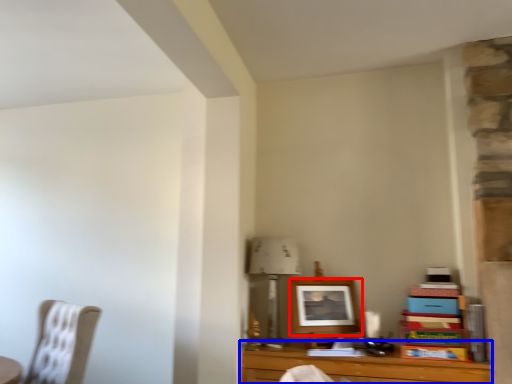
Question: Among these objects, which one is farthest to the camera, picture frame (highlighted by a red box) or table (highlighted by a blue box)?

Choices:
 (A) picture frame
 (B) table

Answer: (A)